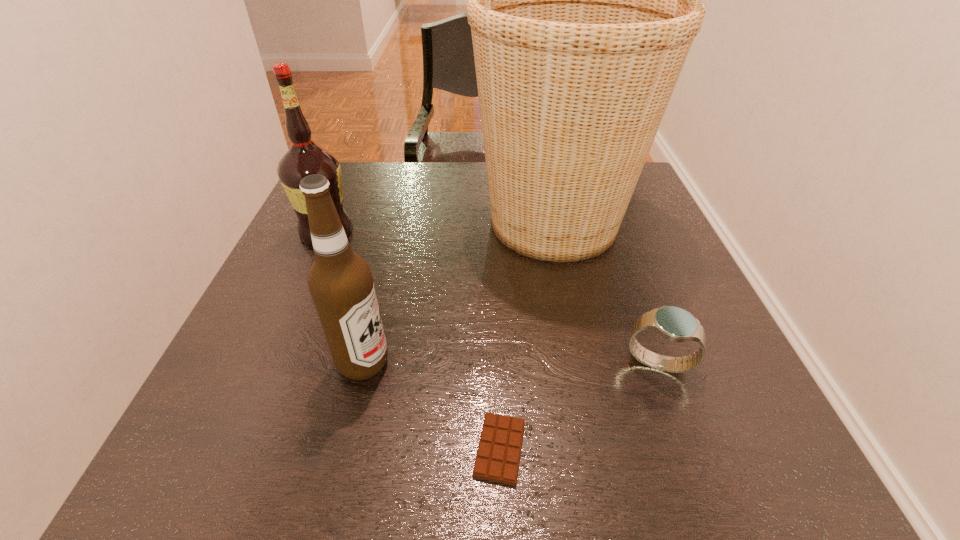
The height and width of the screenshot is (540, 960). I want to click on basket, so click(583, 0).

I want to click on the leftmost object, so click(x=305, y=157).

Where is `the left alcohol`? Image resolution: width=960 pixels, height=540 pixels. the left alcohol is located at coordinates (305, 157).

This screenshot has width=960, height=540. I want to click on the right alcohol, so coord(340,282).

The image size is (960, 540). Identify the location of the nearer alcohol. (340, 282).

The height and width of the screenshot is (540, 960). Identify the location of watch. (673, 323).

Locate an element on the screen. the nearest object is located at coordinates (498, 454).

At what (x,y) coordinates should I click in order to perform the action: click on candy bar. Please return your answer as a coordinate pair (x, y). This screenshot has height=540, width=960. Looking at the image, I should click on (498, 454).

Identify the location of free space located 0.150m on the left of the tallest object. (411, 222).

Locate an element on the screen. vacant space located on the label of the left alcohol is located at coordinates (443, 232).